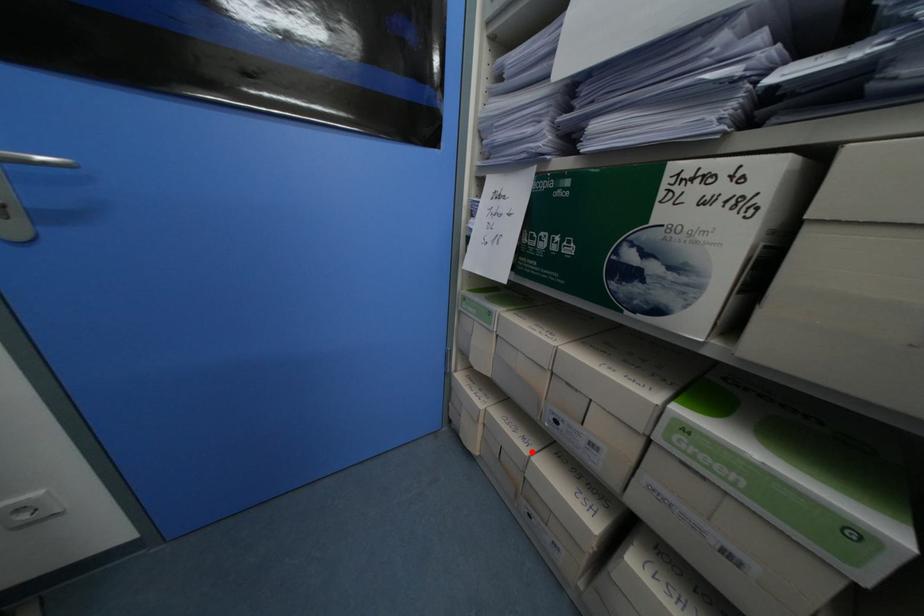
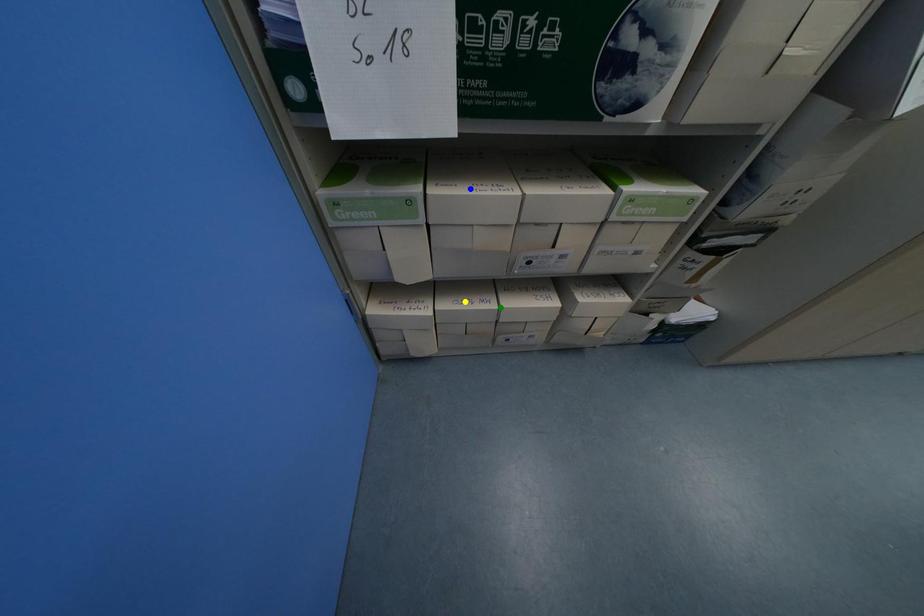
Question: I am providing you with two images of the same scene from different viewpoints. A red point is marked on the first image. You are given multiple points on the second image. Which point in image 2 represents the same 3d spot as the red point in image 1?

Choices:
 (A) green point
 (B) yellow point
 (C) blue point

Answer: (A)